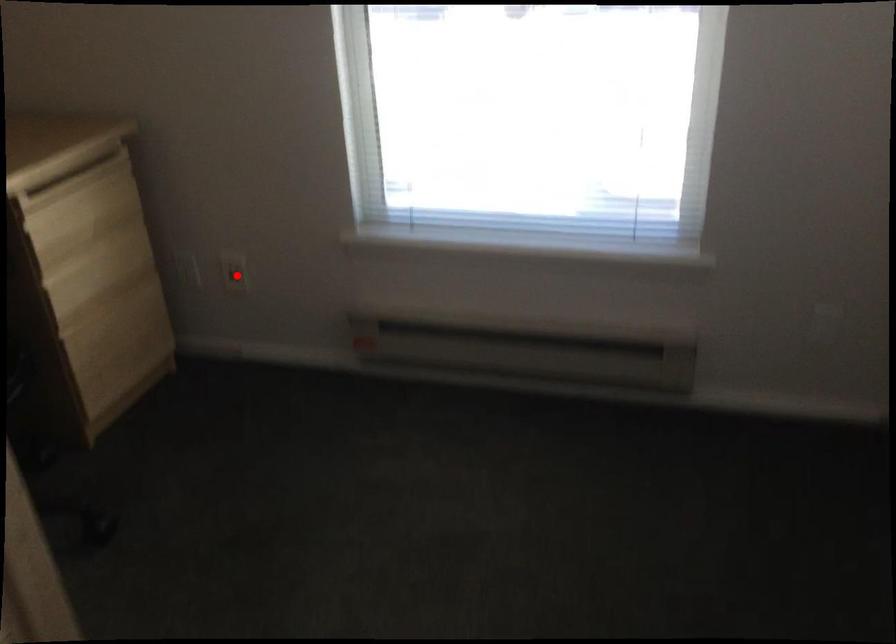
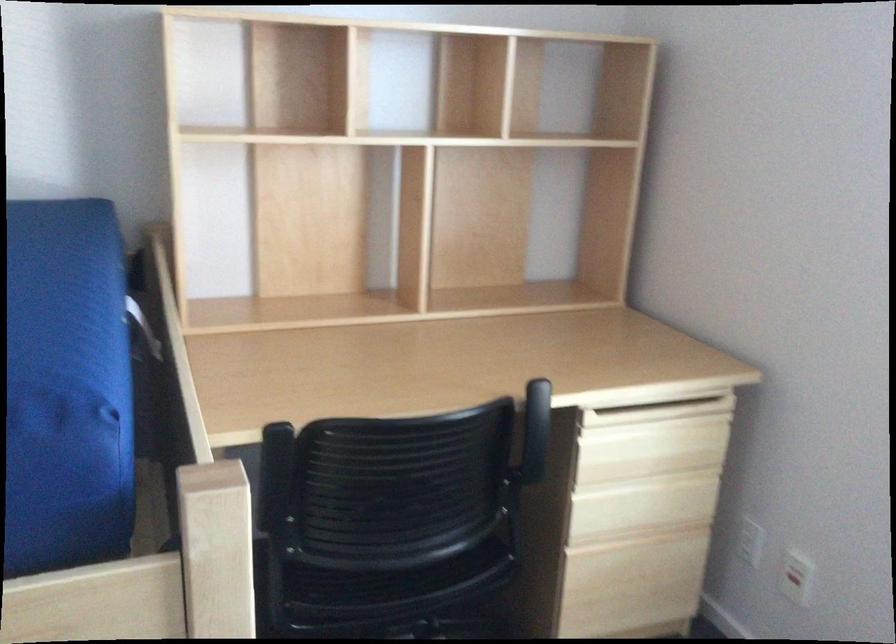
In the second image, find the point that corresponds to the highlighted location in the first image.

(795, 583)